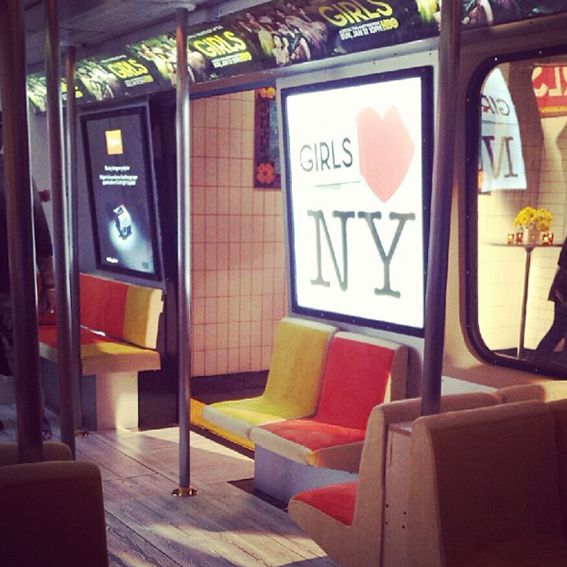
Locate an element on the screen. red seats is located at coordinates (318, 406), (340, 505), (64, 325).